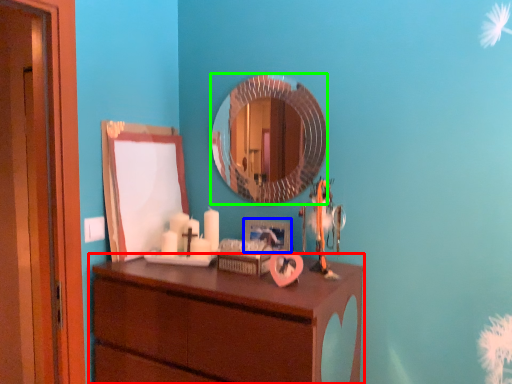
Question: Estimate the real-world distances between objects in this image. Which object is farther from chest of drawers (highlighted by a red box), picture frame (highlighted by a blue box) or mirror (highlighted by a green box)?

Choices:
 (A) picture frame
 (B) mirror

Answer: (B)